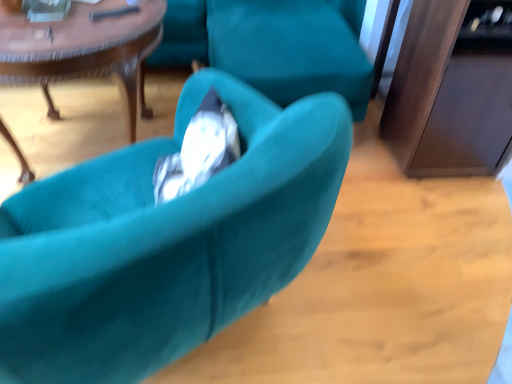
Question: Is teal velvet chair at center not near wooden polished coffee table at center?

Choices:
 (A) no
 (B) yes

Answer: (A)

Question: Can you confirm if teal velvet chair at center is wider than wooden polished coffee table at center?

Choices:
 (A) yes
 (B) no

Answer: (B)

Question: From the image's perspective, is teal velvet chair at center on wooden polished coffee table at center?

Choices:
 (A) no
 (B) yes

Answer: (A)

Question: Is teal velvet chair at center oriented towards wooden polished coffee table at center?

Choices:
 (A) yes
 (B) no

Answer: (A)

Question: Is teal velvet chair at center looking in the opposite direction of wooden polished coffee table at center?

Choices:
 (A) no
 (B) yes

Answer: (A)

Question: Is the position of teal velvet chair at center more distant than that of wooden polished coffee table at center?

Choices:
 (A) yes
 (B) no

Answer: (B)

Question: From a real-world perspective, is wooden polished coffee table at center positioned under teal velvet chair at center based on gravity?

Choices:
 (A) yes
 (B) no

Answer: (A)

Question: Does wooden polished coffee table at center appear on the right side of teal velvet chair at center?

Choices:
 (A) yes
 (B) no

Answer: (B)

Question: Is wooden polished coffee table at center not inside teal velvet chair at center?

Choices:
 (A) no
 (B) yes

Answer: (B)

Question: From the image's perspective, is wooden polished coffee table at center below teal velvet chair at center?

Choices:
 (A) no
 (B) yes

Answer: (A)

Question: Does wooden polished coffee table at center have a greater width compared to teal velvet chair at center?

Choices:
 (A) no
 (B) yes

Answer: (B)

Question: Can you confirm if wooden polished coffee table at center is thinner than teal velvet chair at center?

Choices:
 (A) yes
 (B) no

Answer: (B)

Question: Is wooden polished coffee table at center situated inside teal velvet chair at center or outside?

Choices:
 (A) outside
 (B) inside

Answer: (A)